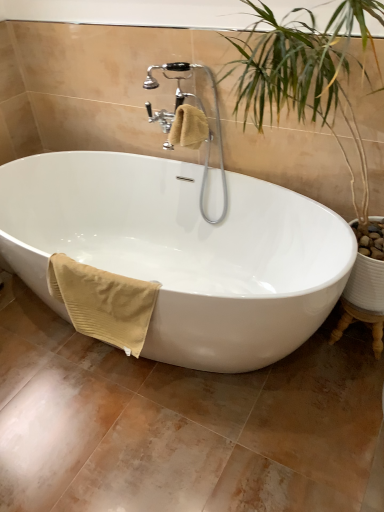
Question: Is polished chrome faucet at upper center bigger or smaller than white glossy bathtub at center?

Choices:
 (A) small
 (B) big

Answer: (A)

Question: From a real-world perspective, is polished chrome faucet at upper center positioned above or below white glossy bathtub at center?

Choices:
 (A) below
 (B) above

Answer: (B)

Question: Which of these objects is positioned closest to the white glossy bathtub at center?

Choices:
 (A) polished chrome faucet at upper center
 (B) beige ribbed towel at lower left, which is the second bath towel in right-to-left order
 (C) beige cotton towel at upper center, placed as the first bath towel when sorted from top to bottom

Answer: (B)

Question: Which object is positioned farthest from the beige cotton towel at upper center, which appears as the 2th bath towel when viewed from the left?

Choices:
 (A) white glossy bathtub at center
 (B) beige ribbed towel at lower left, acting as the first bath towel starting from the bottom
 (C) polished chrome faucet at upper center

Answer: (B)